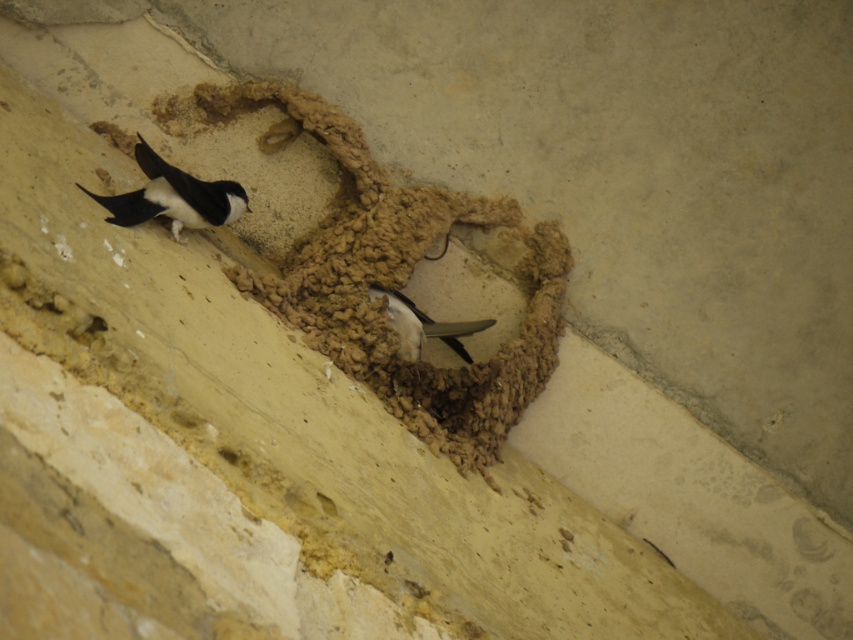
Can you confirm if black glossy swallow at upper left is positioned above white glossy bird at center?

Yes, black glossy swallow at upper left is above white glossy bird at center.

Between black glossy swallow at upper left and white glossy bird at center, which one is positioned higher?

black glossy swallow at upper left is higher up.

Locate an element on the screen. The image size is (853, 640). black glossy swallow at upper left is located at coordinates 173,196.